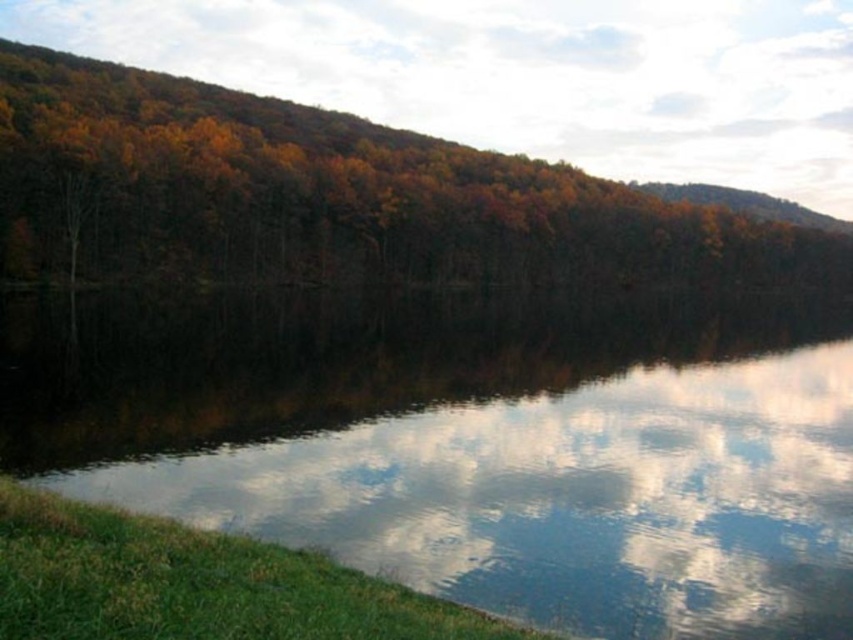
Question: Does clear water at lower left have a lesser width compared to autumn leaves at upper left?

Choices:
 (A) yes
 (B) no

Answer: (A)

Question: Does clear water at lower left appear over autumn leaves at upper left?

Choices:
 (A) yes
 (B) no

Answer: (B)

Question: Which point appears farthest from the camera in this image?

Choices:
 (A) (674, 404)
 (B) (502, 195)

Answer: (B)

Question: Which point is farther to the camera?

Choices:
 (A) autumn leaves at upper left
 (B) clear water at lower left

Answer: (A)

Question: Is clear water at lower left above autumn leaves at upper left?

Choices:
 (A) no
 (B) yes

Answer: (A)